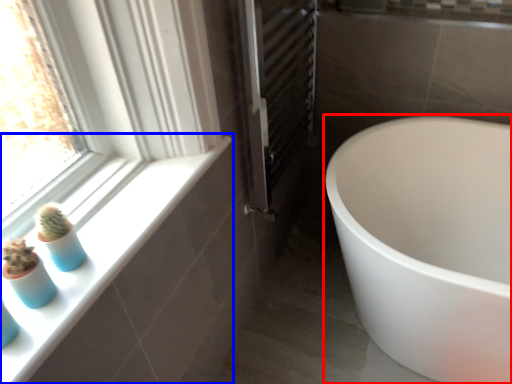
Question: Which point is closer to the camera, bathtub (highlighted by a red box) or window sill (highlighted by a blue box)?

Choices:
 (A) bathtub
 (B) window sill

Answer: (B)